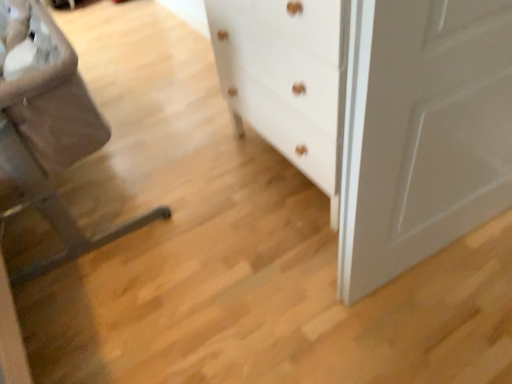
Question: Is white matte chest of drawers at center taller or shorter than brown fabric rocking chair at left?

Choices:
 (A) short
 (B) tall

Answer: (B)

Question: From a real-world perspective, is white matte chest of drawers at center physically located above or below brown fabric rocking chair at left?

Choices:
 (A) below
 (B) above

Answer: (B)

Question: In terms of width, does white matte chest of drawers at center look wider or thinner when compared to brown fabric rocking chair at left?

Choices:
 (A) wide
 (B) thin

Answer: (B)

Question: From the image's perspective, is brown fabric rocking chair at left above or below white matte chest of drawers at center?

Choices:
 (A) below
 (B) above

Answer: (A)

Question: From a real-world perspective, relative to white matte chest of drawers at center, is brown fabric rocking chair at left vertically above or below?

Choices:
 (A) above
 (B) below

Answer: (B)

Question: Is brown fabric rocking chair at left wider or thinner than white matte chest of drawers at center?

Choices:
 (A) wide
 (B) thin

Answer: (A)

Question: Considering the positions of brown fabric rocking chair at left and white matte chest of drawers at center in the image, is brown fabric rocking chair at left taller or shorter than white matte chest of drawers at center?

Choices:
 (A) tall
 (B) short

Answer: (B)